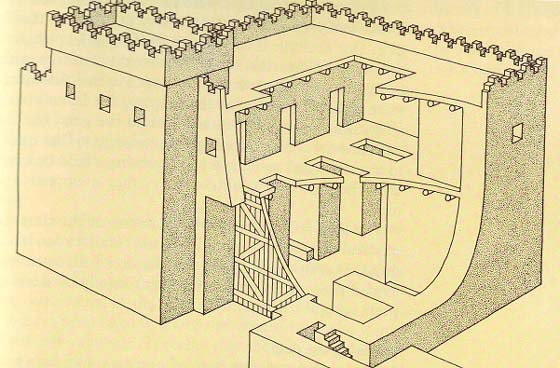
Where is `floor`? The image size is (560, 368). floor is located at coordinates (335, 139), (356, 255).